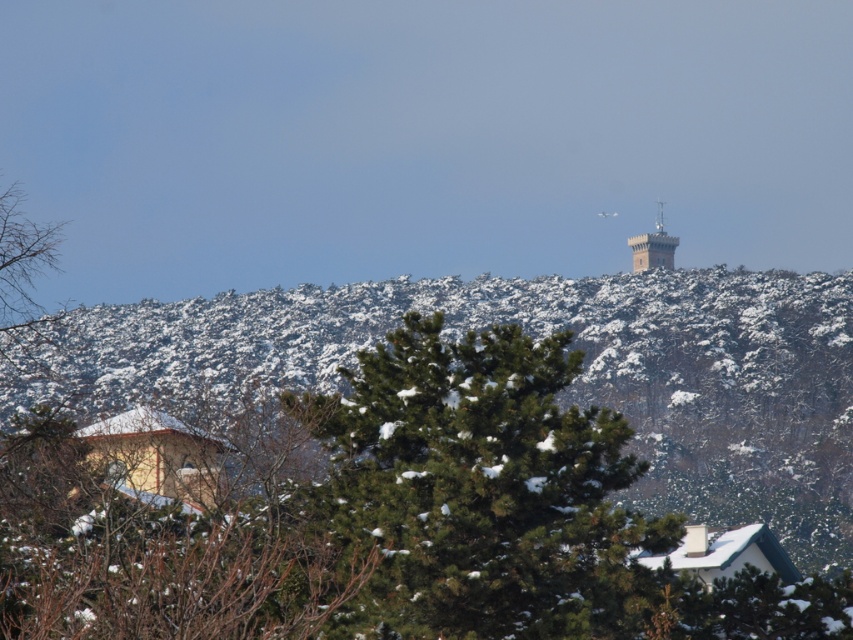
Between green textured pine tree at center and brick tower at upper center, which one is positioned lower?

green textured pine tree at center is lower down.

What do you see at coordinates (480, 492) in the screenshot? The height and width of the screenshot is (640, 853). I see `green textured pine tree at center` at bounding box center [480, 492].

Is point (299, 401) more distant than point (669, 236)?

No, (299, 401) is closer to viewer.

The height and width of the screenshot is (640, 853). Find the location of `green textured pine tree at center`. green textured pine tree at center is located at coordinates (480, 492).